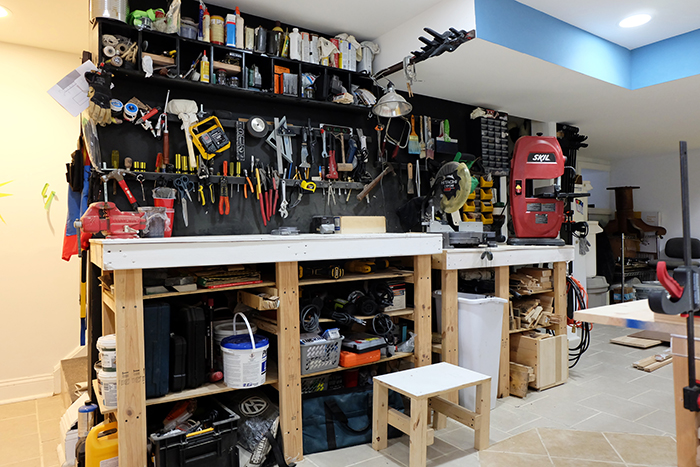
Where is `table`? The width and height of the screenshot is (700, 467). table is located at coordinates (209, 251).